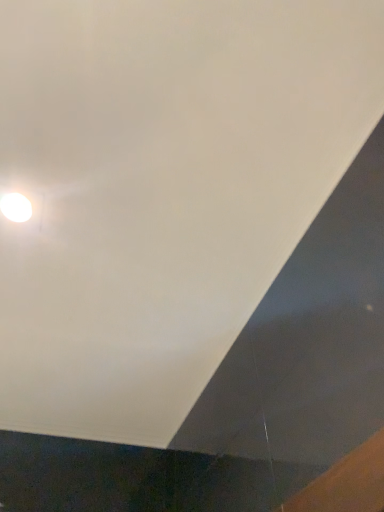
This screenshot has height=512, width=384. What do you see at coordinates (16, 207) in the screenshot?
I see `white glossy lamp at upper left` at bounding box center [16, 207].

At what (x,y) coordinates should I click in order to perform the action: click on white glossy lamp at upper left. Please return your answer as a coordinate pair (x, y). The height and width of the screenshot is (512, 384). Looking at the image, I should click on (16, 207).

The image size is (384, 512). What are the coordinates of `white glossy lamp at upper left` in the screenshot? It's located at (16, 207).